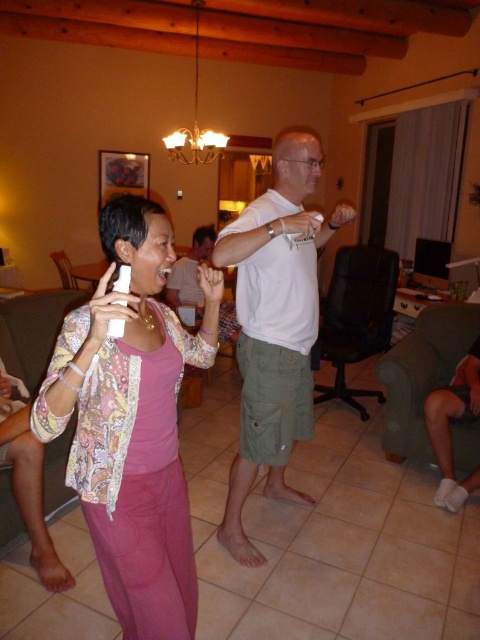
You are a fashion designer observing the scene. You notice the matte pink pants at center and the white cotton shirt at center. Which clothing item is located lower on the person?

The matte pink pants at center are positioned under the white cotton shirt at center, so the matte pink pants at center are located lower on the person.

You are standing in the room and want to move from the point at coordinates point (100, 444) to the point at coordinates point (276, 472). Can you walk directly between them without any obstacles?

Point (100, 444) is in front of point (276, 472), so there might be an obstacle between them. You cannot walk directly between them without any obstacles.